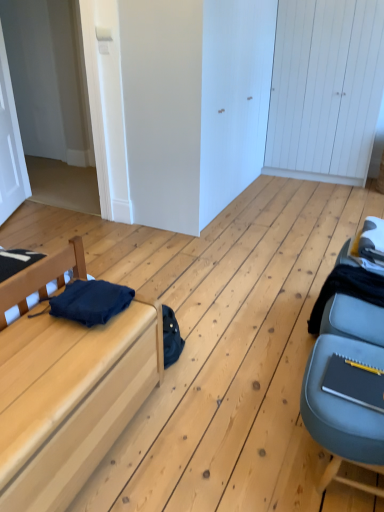
Question: Choose the correct answer: Is white wooden door at upper right, which is counted as the first door, starting from the right, inside matte wood bed at left or outside it?

Choices:
 (A) outside
 (B) inside

Answer: (A)

Question: From the image's perspective, is white wooden door at upper right, the first door from the back, located above or below matte wood bed at left?

Choices:
 (A) above
 (B) below

Answer: (A)

Question: Estimate the real-world distances between objects in this image. Which object is closer to the white wooden door at upper right, the first door from the back?

Choices:
 (A) white matte door at upper left, the 2th door from the right
 (B) dark blue fabric at left, the first clothing in the front-to-back sequence
 (C) black fabric at right, which ranks as the second clothing in front-to-back order
 (D) matte wood bed at left

Answer: (C)

Question: Estimate the real-world distances between objects in this image. Which object is closer to the black fabric at right, which is the first clothing from back to front?

Choices:
 (A) white matte door at upper left, the 2th door from the right
 (B) matte wood bed at left
 (C) dark blue fabric at left, which ranks as the second clothing in back-to-front order
 (D) white wooden door at upper right, positioned as the 2th door in left-to-right order

Answer: (C)